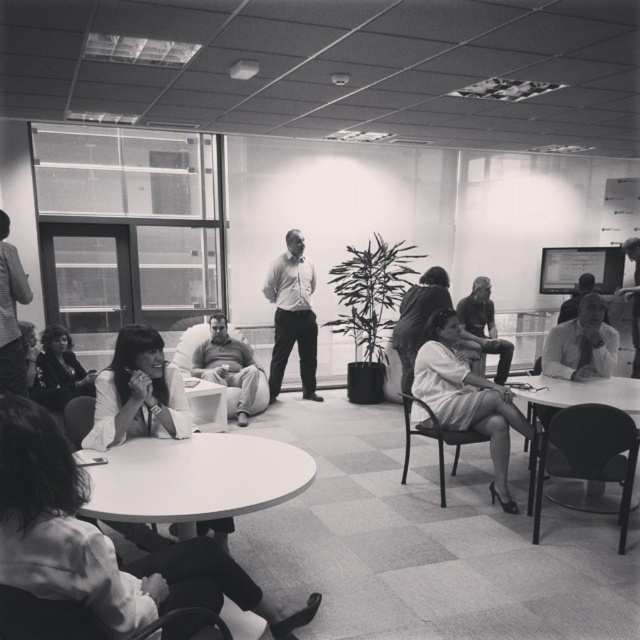
Which is more to the right, smooth beige pants at center or striped shirt at left?

smooth beige pants at center

Between point (253, 380) and point (19, 288), which one is positioned in front?

Point (19, 288)

Which is behind, point (237, 376) or point (17, 344)?

The point (237, 376) is more distant.

This screenshot has width=640, height=640. I want to click on smooth beige pants at center, so click(x=227, y=365).

Is matte white shirt at center taller than white shirt at right?

Yes, matte white shirt at center is taller than white shirt at right.

Between matte white shirt at center and white shirt at right, which one has less height?

With less height is white shirt at right.

Is point (288, 230) farther from camera compared to point (593, 304)?

Yes, point (288, 230) is behind point (593, 304).

At what (x,y) coordinates should I click in order to perform the action: click on matte white shirt at center. Please return your answer as a coordinate pair (x, y). This screenshot has height=640, width=640. Looking at the image, I should click on (292, 316).

Based on the photo, who is more distant from viewer, (195, 612) or (12, 392)?

The point (12, 392) is behind.

Does black leather chair at lower left appear under striped shirt at left?

Indeed, black leather chair at lower left is positioned under striped shirt at left.

Where is `black leather chair at lower left`? This screenshot has height=640, width=640. black leather chair at lower left is located at coordinates (45, 618).